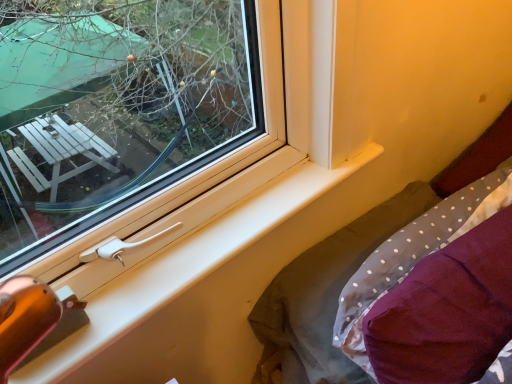
Question: Is gray polka dot fabric at lower right inside the boundaries of maroon fabric pillow at lower right, or outside?

Choices:
 (A) outside
 (B) inside

Answer: (A)

Question: Based on their positions, is gray polka dot fabric at lower right located to the left or right of maroon fabric pillow at lower right?

Choices:
 (A) left
 (B) right

Answer: (A)

Question: Which is nearer to the maroon fabric pillow at lower right?

Choices:
 (A) white plastic window sill at lower left
 (B) gray polka dot fabric at lower right

Answer: (B)

Question: Which is farther from the white plastic window sill at lower left?

Choices:
 (A) gray polka dot fabric at lower right
 (B) maroon fabric pillow at lower right

Answer: (B)